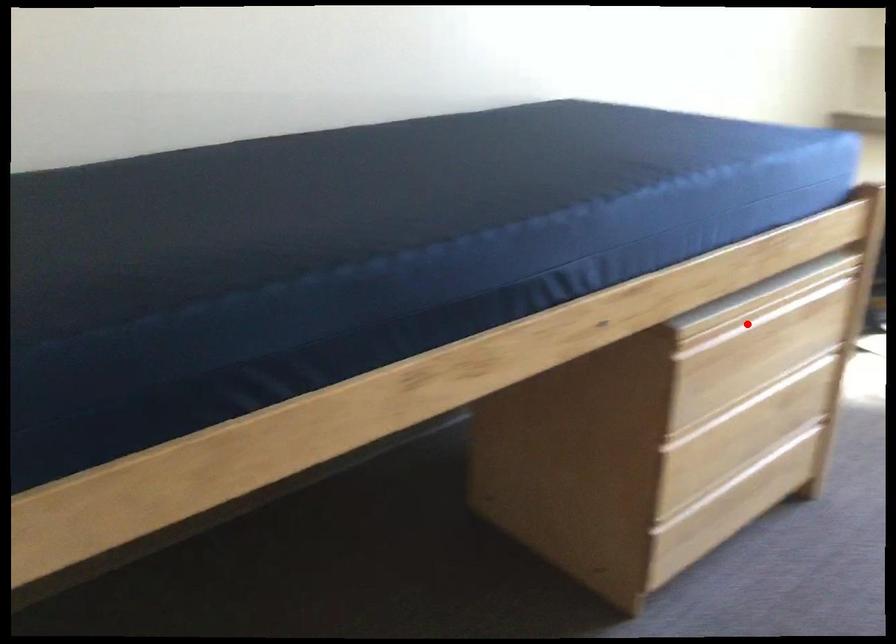
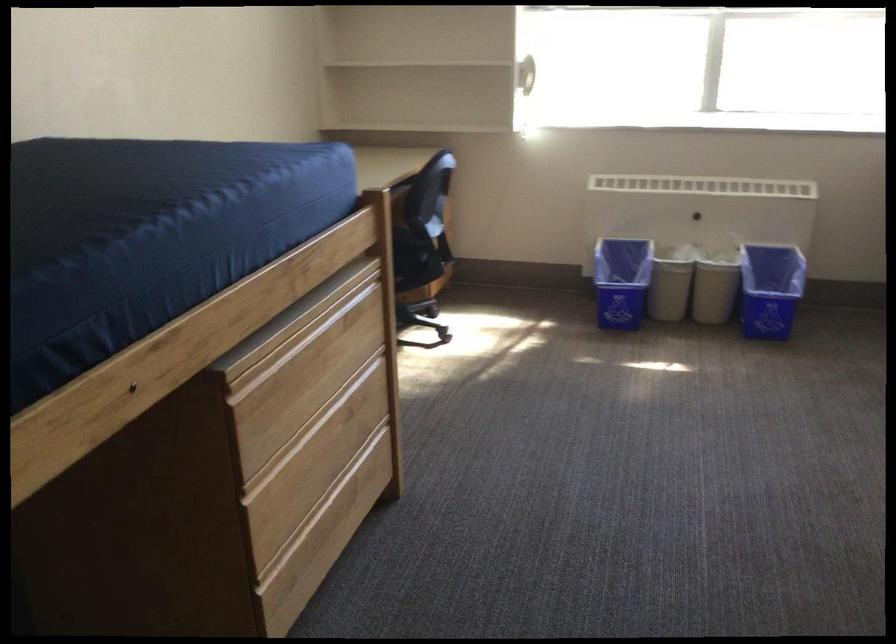
Locate, in the second image, the point that corresponds to the highlighted location in the first image.

(296, 346)